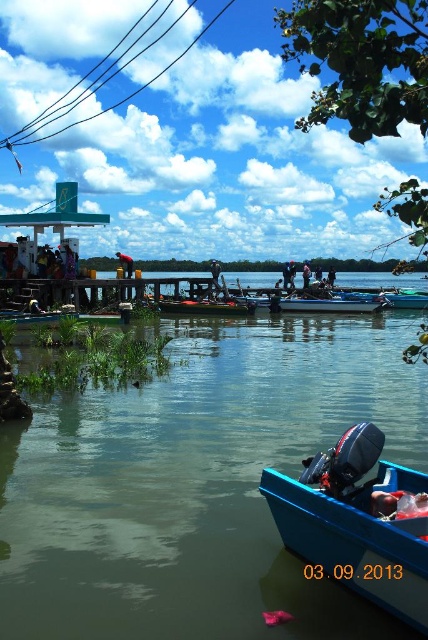
Question: Where is green smooth water at lower left located in relation to reddish-orange fabric at dock center in the image?

Choices:
 (A) left
 (B) right

Answer: (B)

Question: Among these points, which one is nearest to the camera?

Choices:
 (A) (175, 301)
 (B) (184, 632)

Answer: (B)

Question: Which point is closer to the camera?

Choices:
 (A) (327, 273)
 (B) (121, 253)

Answer: (B)

Question: Is blue plastic boat at lower right above reddish-orange fabric at dock center?

Choices:
 (A) no
 (B) yes

Answer: (A)

Question: Can you confirm if blue fabric shirt at center is smaller than dark blue fabric shirt at center?

Choices:
 (A) no
 (B) yes

Answer: (B)

Question: Which point is farther from the camera taking this photo?

Choices:
 (A) (303, 268)
 (B) (422, 388)
 (C) (213, 278)

Answer: (A)